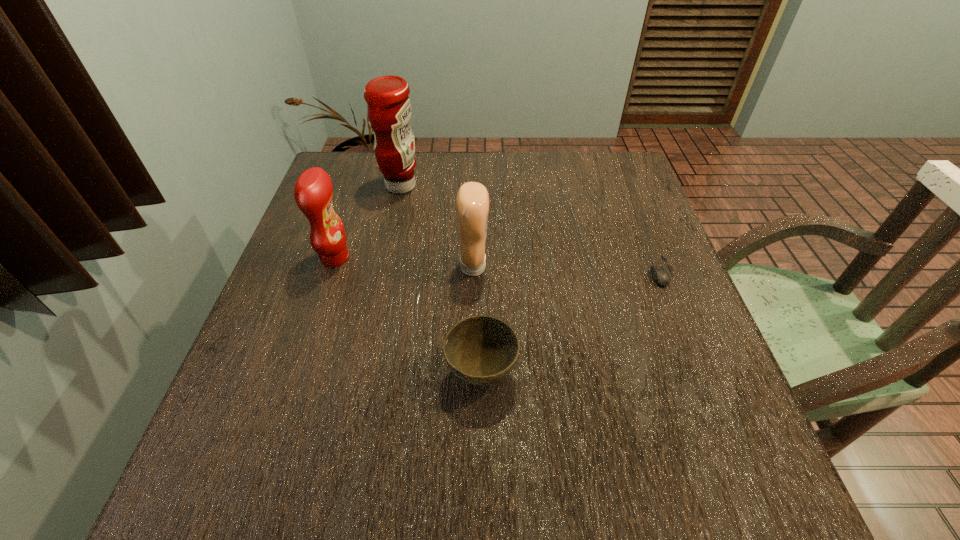
You are a GUI agent. You are given a task and a screenshot of the screen. Output one action in this format:
    pyautogui.click(x=<x>, y=<y>)
    Task: Click on the object that is the third closest to the rightmost object
    The image size is (960, 540).
    Given the screenshot: What is the action you would take?
    pyautogui.click(x=388, y=105)

Select which condiment is the second closest to the rightmost condiment. Please provide its 2D coordinates. Your answer should be formatted as a tuple, i.e. [(x, y)], where the tuple contains the x and y coordinates of a point satisfying the conditions above.

[(313, 191)]

Find the location of a particular element. Image resolution: width=960 pixels, height=540 pixels. condiment that is the second closest to the rightmost condiment is located at coordinates (313, 191).

This screenshot has width=960, height=540. In order to click on vacant space that satisfies the following two spatial constraints: 1. on the label side of the leftmost condiment; 2. on the right side of the mouse in this screenshot , I will do `click(330, 271)`.

The image size is (960, 540). Find the location of `free space that satisfies the following two spatial constraints: 1. on the label side of the leftmost condiment; 2. on the back side of the bowl`. free space that satisfies the following two spatial constraints: 1. on the label side of the leftmost condiment; 2. on the back side of the bowl is located at coordinates (297, 373).

At what (x,y) coordinates should I click in order to perform the action: click on vacant space that satisfies the following two spatial constraints: 1. on the label of the mouse; 2. on the left side of the rightmost condiment. Please return your answer as a coordinate pair (x, y). The height and width of the screenshot is (540, 960). Looking at the image, I should click on (473, 271).

Find the location of `free location that satisfies the following two spatial constraints: 1. on the label of the rightmost condiment; 2. on the right side of the nearest object`. free location that satisfies the following two spatial constraints: 1. on the label of the rightmost condiment; 2. on the right side of the nearest object is located at coordinates (472, 373).

Where is `vacant area that satisfies the following two spatial constraints: 1. on the label of the rightmost condiment; 2. on the back side of the fourth tallest object`? The width and height of the screenshot is (960, 540). vacant area that satisfies the following two spatial constraints: 1. on the label of the rightmost condiment; 2. on the back side of the fourth tallest object is located at coordinates (472, 373).

Where is `vacant space that satisfies the following two spatial constraints: 1. on the label side of the leftmost condiment; 2. on the back side of the shortest object`? The width and height of the screenshot is (960, 540). vacant space that satisfies the following two spatial constraints: 1. on the label side of the leftmost condiment; 2. on the back side of the shortest object is located at coordinates (330, 271).

I want to click on free point that satisfies the following two spatial constraints: 1. on the label of the bowl; 2. on the left side of the rightmost condiment, so click(x=472, y=373).